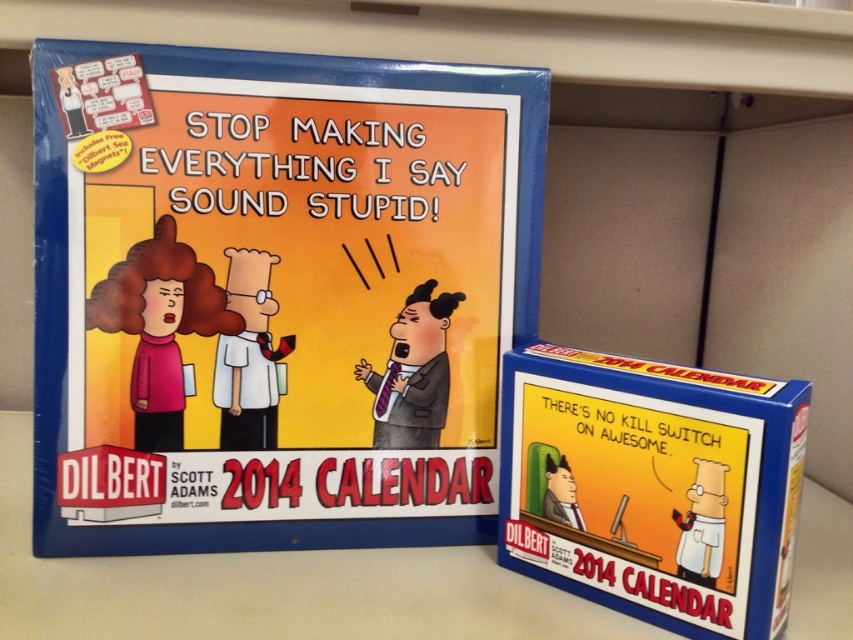
Question: Is matte blue calendar at upper left below blue cardboard box at center?

Choices:
 (A) yes
 (B) no

Answer: (B)

Question: Can you confirm if matte blue calendar at upper left is positioned to the right of blue cardboard box at center?

Choices:
 (A) yes
 (B) no

Answer: (B)

Question: Does matte blue calendar at upper left come in front of blue cardboard box at center?

Choices:
 (A) no
 (B) yes

Answer: (A)

Question: Among these objects, which one is nearest to the camera?

Choices:
 (A) blue cardboard box at center
 (B) matte blue calendar at upper left

Answer: (A)